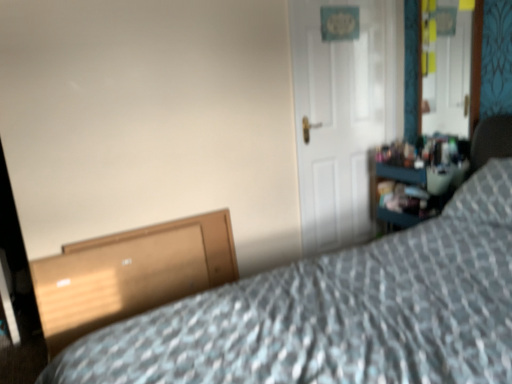
Question: Considering the positions of metallic mirror at upper right and wooden file cabinet at lower left in the image, is metallic mirror at upper right wider or thinner than wooden file cabinet at lower left?

Choices:
 (A) wide
 (B) thin

Answer: (B)

Question: Relative to wooden file cabinet at lower left, is metallic mirror at upper right in front or behind?

Choices:
 (A) front
 (B) behind

Answer: (B)

Question: Which object is positioned farthest from the metallic mirror at upper right?

Choices:
 (A) wooden dresser at right
 (B) white matte door at center
 (C) wooden file cabinet at lower left
 (D) patterned fabric bed at lower right

Answer: (C)

Question: Based on their relative distances, which object is nearer to the white matte door at center?

Choices:
 (A) wooden file cabinet at lower left
 (B) patterned fabric bed at lower right
 (C) metallic mirror at upper right
 (D) wooden dresser at right

Answer: (D)